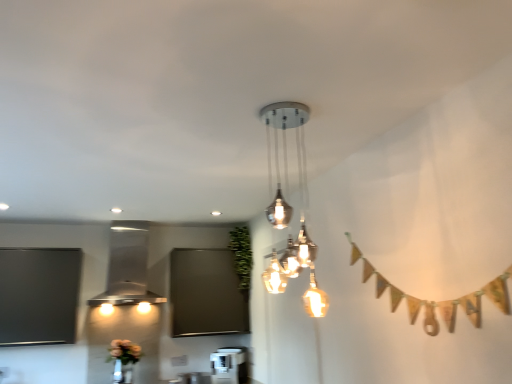
Question: Is satin silver pendant light at center, which is the second lamp in back-to-front order, spatially inside stainless steel range hood at left, the first lamp in the back-to-front sequence, or outside of it?

Choices:
 (A) inside
 (B) outside

Answer: (B)

Question: In terms of size, does satin silver pendant light at center, the 1th lamp viewed from the right, appear bigger or smaller than stainless steel range hood at left, the first lamp in the back-to-front sequence?

Choices:
 (A) small
 (B) big

Answer: (A)

Question: Which of these objects is positioned farthest from the matte floral arrangement at lower left?

Choices:
 (A) green leafy plant at center
 (B) stainless steel range hood at left, the first lamp in the back-to-front sequence
 (C) satin silver pendant light at center, marked as the 1th lamp in a front-to-back arrangement

Answer: (C)

Question: Which object is the closest to the green leafy plant at center?

Choices:
 (A) stainless steel range hood at left, marked as the 2th lamp in a front-to-back arrangement
 (B) satin silver pendant light at center, which appears as the 2th lamp when viewed from the left
 (C) matte floral arrangement at lower left

Answer: (A)